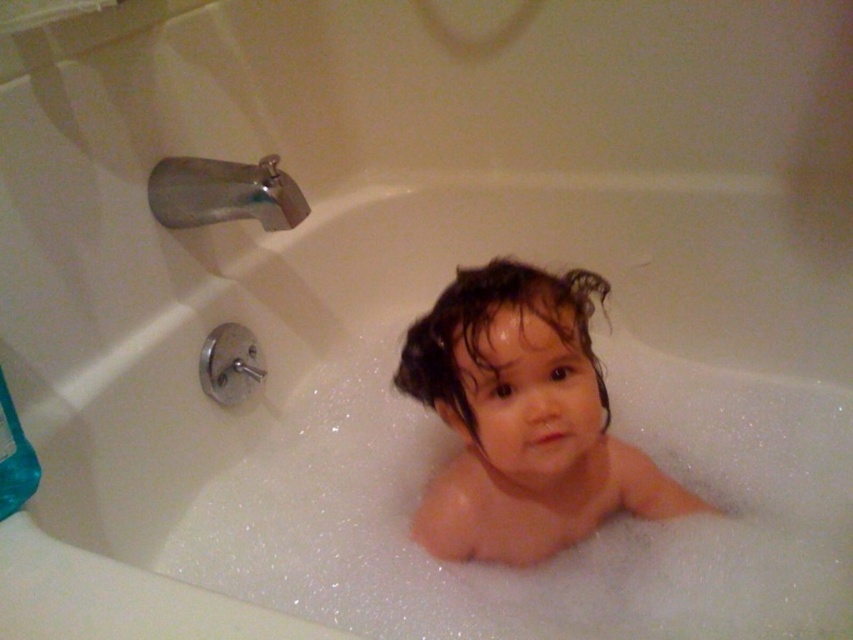
Based on the scene, if you were to place a small rubber duck between the wet skin toddler at center and the silver metallic faucet at upper left, which object would the duck be closer to?

The small rubber duck would be closer to the silver metallic faucet at upper left because the wet skin toddler at center is larger in size and occupies more space, creating a greater distance between them.

The scene shows a child in a bathtub with a blue bottle to the left edge of the frame. Where is the point at coordinates (521, 419) located in relation to the wet skin toddler at center?

The point at coordinates (521, 419) corresponds to the wet skin toddler at center.

Based on the scene description, where is the wet skin toddler at center in relation to the silver metallic faucet at upper left?

The wet skin toddler at center is to the right of the silver metallic faucet at upper left.